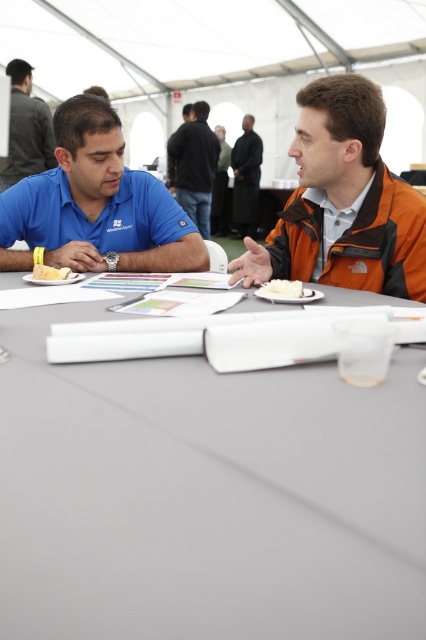
You are a caterer who needs to place a dessert platter that is 36 inches long on the table. The platter must be placed between the white matte table at center and the yellow cake at left. Can the platter fit without overlapping either object?

The distance between the white matte table at center and the yellow cake at left is 36.56 inches. Since the dessert platter is 36 inches long, it can fit within the space without overlapping either object.

Where is the matte blue shirt at left located in the image?

The matte blue shirt at left is located at the 2D coordinates point (95, 204).

You are organizing a photo shoot and need to ensure that the matte blue shirt at left and the white fluffy cake at center are both visible in the frame. Given their sizes, which object might require more careful positioning to avoid being cropped out?

The matte blue shirt at left is wider than the white fluffy cake at center, so the shirt may require more careful positioning to avoid being cropped out due to its greater width.